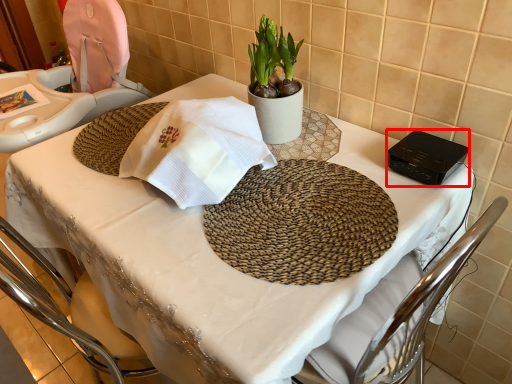
Question: From the image's perspective, where is gadget (annotated by the red box) located relative to houseplant?

Choices:
 (A) below
 (B) above

Answer: (A)